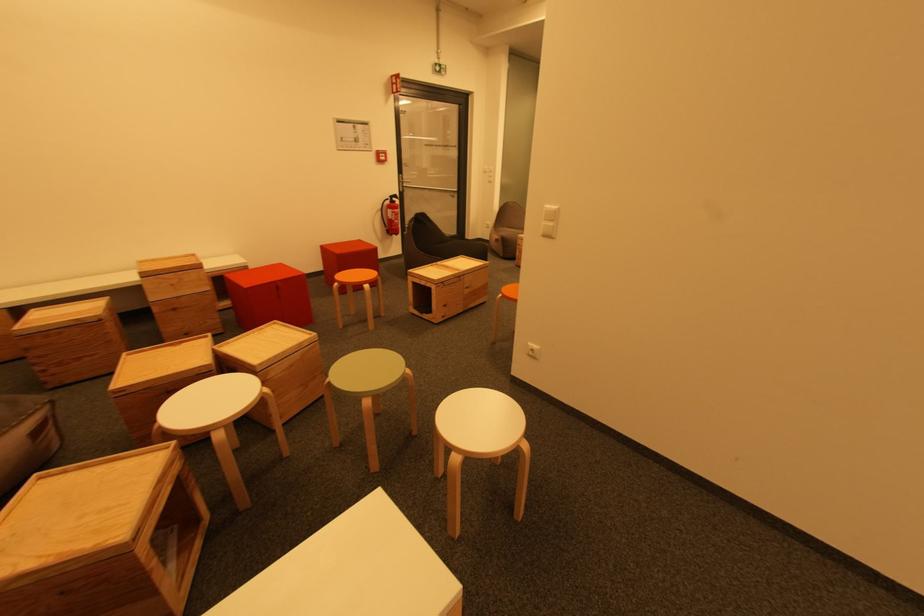
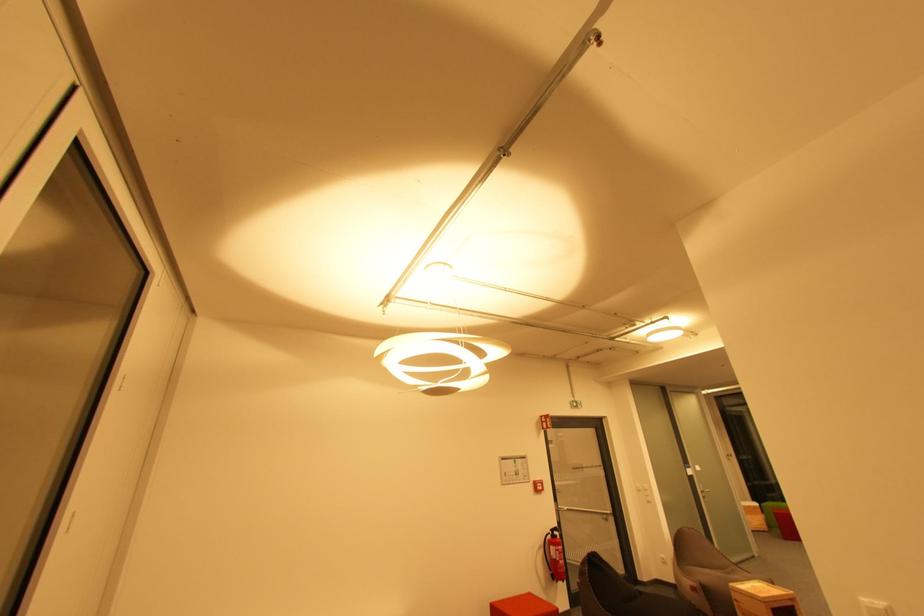
How did the camera likely rotate?

The camera's rotation is toward left-up.